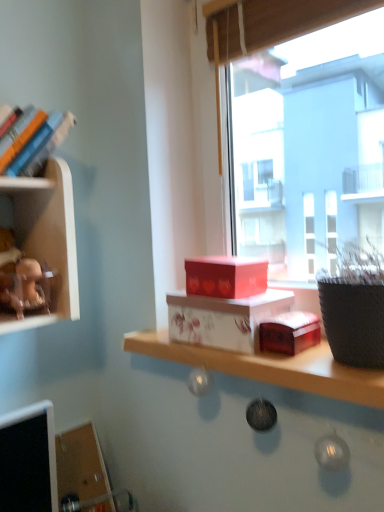
Question: From the image's perspective, is matte brown figurine at upper left below transparent glass window at center?

Choices:
 (A) yes
 (B) no

Answer: (A)

Question: Is transparent glass window at center surrounded by matte brown figurine at upper left?

Choices:
 (A) no
 (B) yes

Answer: (A)

Question: Is matte brown figurine at upper left closer to the viewer compared to transparent glass window at center?

Choices:
 (A) yes
 (B) no

Answer: (B)

Question: Is matte brown figurine at upper left at the left side of transparent glass window at center?

Choices:
 (A) no
 (B) yes

Answer: (B)

Question: Is matte brown figurine at upper left facing away from transparent glass window at center?

Choices:
 (A) yes
 (B) no

Answer: (B)

Question: Is matte brown figurine at upper left smaller than transparent glass window at center?

Choices:
 (A) no
 (B) yes

Answer: (B)

Question: Considering the relative sizes of white glossy box at center and matte brown figurine at upper left in the image provided, is white glossy box at center bigger than matte brown figurine at upper left?

Choices:
 (A) no
 (B) yes

Answer: (B)

Question: From the image's perspective, is white glossy box at center under matte brown figurine at upper left?

Choices:
 (A) no
 (B) yes

Answer: (B)

Question: From the image's perspective, is white glossy box at center located above matte brown figurine at upper left?

Choices:
 (A) yes
 (B) no

Answer: (B)

Question: Is white glossy box at center facing away from matte brown figurine at upper left?

Choices:
 (A) no
 (B) yes

Answer: (A)

Question: Is white glossy box at center in front of matte brown figurine at upper left?

Choices:
 (A) no
 (B) yes

Answer: (B)

Question: Is white glossy box at center smaller than matte brown figurine at upper left?

Choices:
 (A) no
 (B) yes

Answer: (A)

Question: From a real-world perspective, is white glossy box at center physically above transparent glass window at center?

Choices:
 (A) no
 (B) yes

Answer: (A)